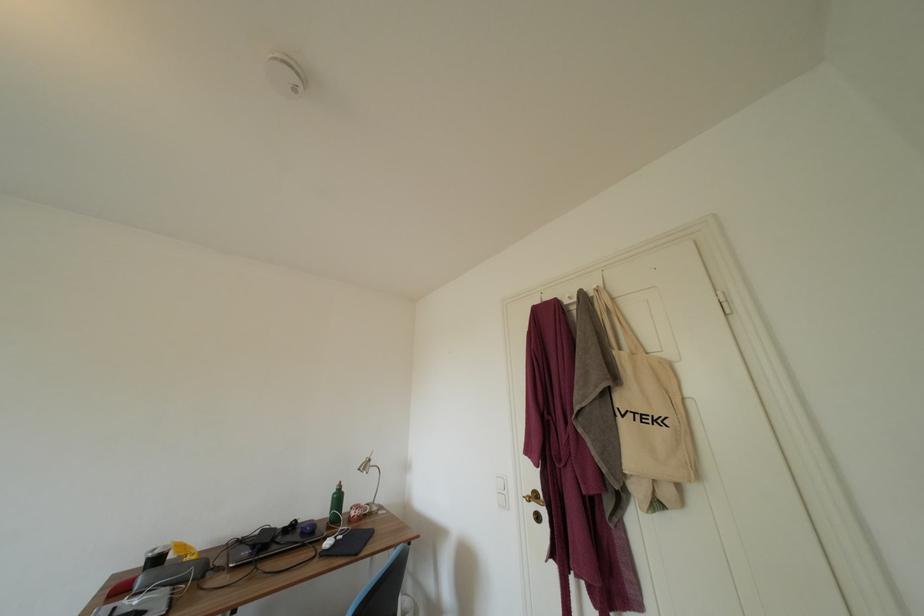
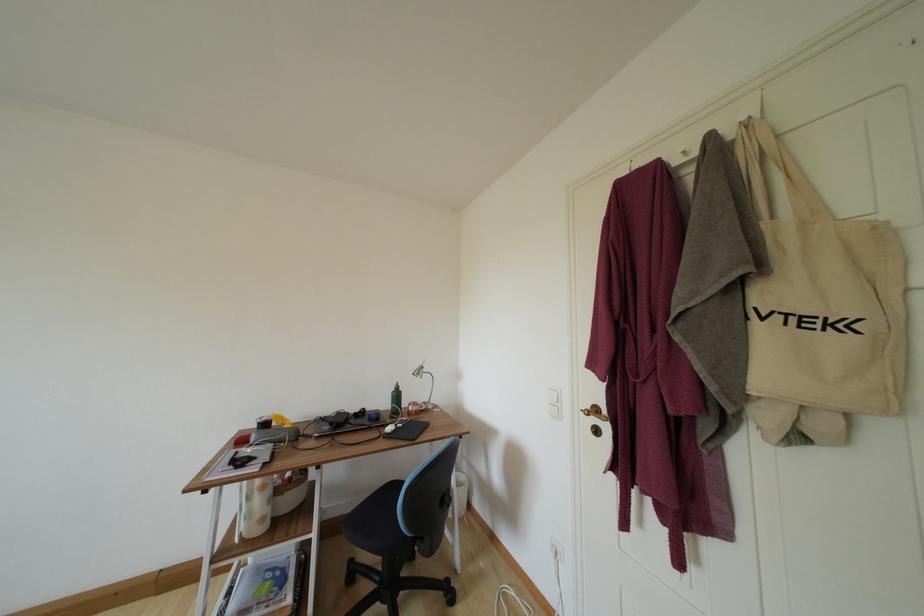
Question: Based on the continuous images, in which direction is the camera rotating? Reply with the corresponding letter.

Choices:
 (A) Left
 (B) Right
 (C) Up
 (D) Down

Answer: (D)